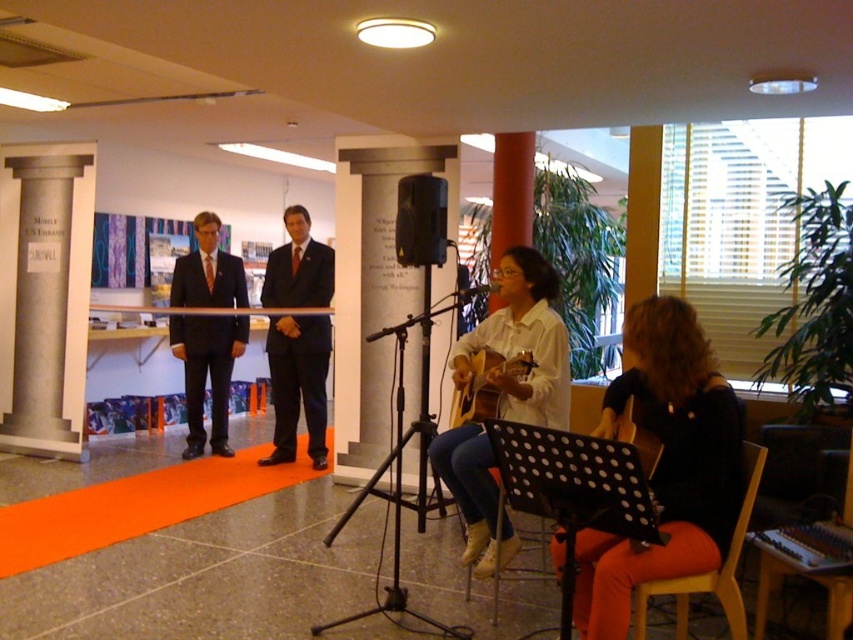
Question: Which is nearer to the orange fabric chair at lower right?

Choices:
 (A) wooden acoustic guitar at center
 (B) black fabric guitar at lower right
 (C) black plastic speaker at center

Answer: (B)

Question: From the image, what is the correct spatial relationship of matte black suit at center in relation to black plastic speaker at center?

Choices:
 (A) below
 (B) above

Answer: (A)

Question: Among these points, which one is nearest to the camera?

Choices:
 (A) (469, 403)
 (B) (543, 310)
 (C) (643, 364)
 (D) (323, 433)

Answer: (C)

Question: Which point is closer to the camera?

Choices:
 (A) matte black suit at center
 (B) wooden acoustic guitar at center

Answer: (B)

Question: Does orange fabric chair at lower right have a smaller size compared to black matte microphone at center?

Choices:
 (A) yes
 (B) no

Answer: (B)

Question: Can you confirm if matte white shirt at center is positioned to the left of wooden acoustic guitar at center?

Choices:
 (A) no
 (B) yes

Answer: (A)